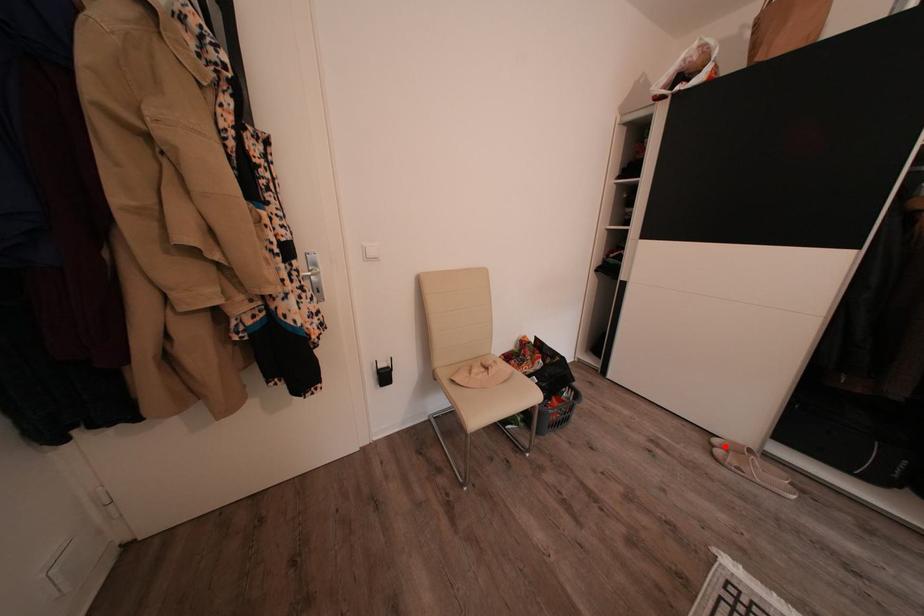
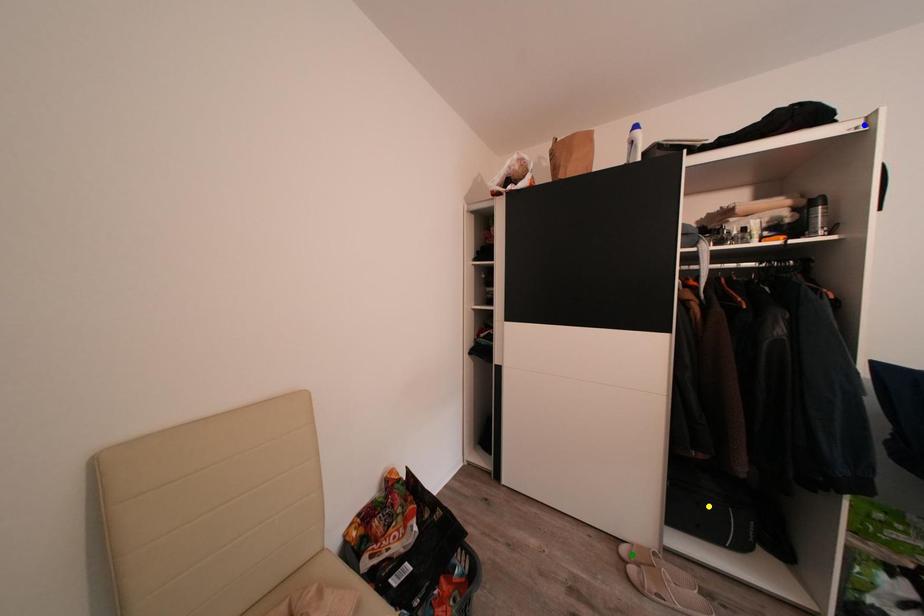
Question: I am providing you with two images of the same scene from different viewpoints. A red point is marked on the first image. You are given multiple points on the second image. Which mark in image 2 goes with the point in image 1?

Choices:
 (A) blue point
 (B) green point
 (C) yellow point

Answer: (B)